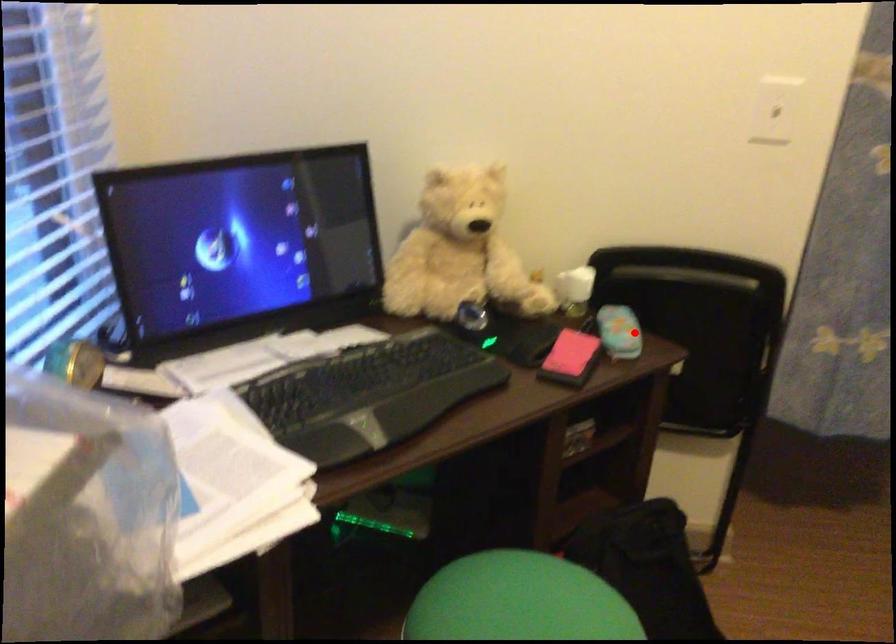
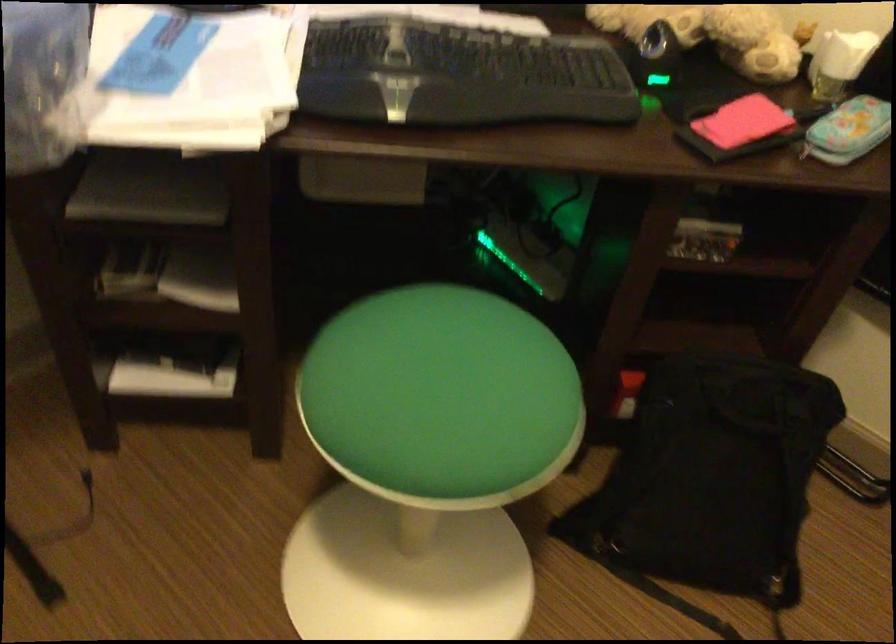
Question: I am providing you with two images of the same scene from different viewpoints. In image1, a red point is highlighted. Considering the same 3D point in image2, which of the following is correct?

Choices:
 (A) It is closer
 (B) It is farther

Answer: (A)